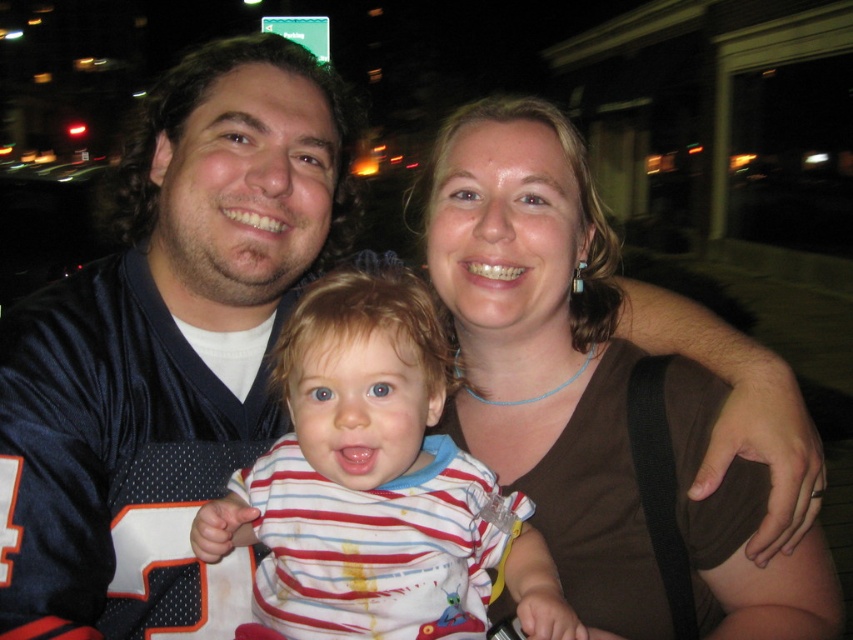
Looking at this image, can you confirm if brown fabric shirt at upper right is positioned above striped cotton shirt at center?

Yes.

Between point (582, 387) and point (314, 548), which one is positioned behind?

Point (582, 387)

Which is behind, point (497, 611) or point (294, 349)?

Positioned behind is point (497, 611).

This screenshot has height=640, width=853. I want to click on brown fabric shirt at upper right, so click(543, 348).